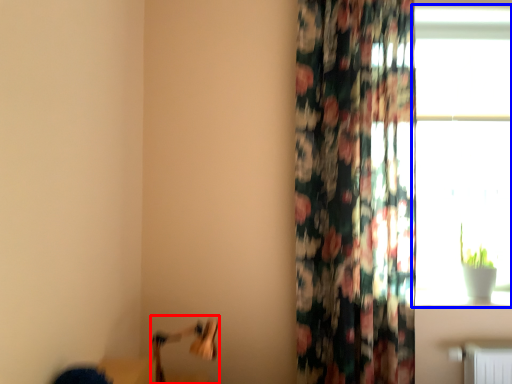
Question: Among these objects, which one is farthest to the camera, swivel chair (highlighted by a red box) or window (highlighted by a blue box)?

Choices:
 (A) swivel chair
 (B) window

Answer: (B)